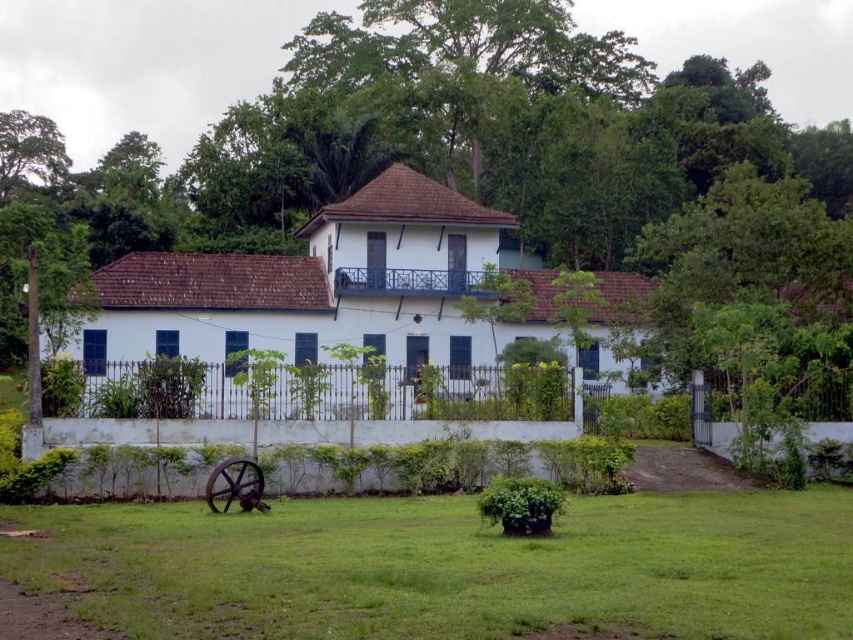
Question: Does green grass at lower center appear on the left side of green leafy tree at upper left?

Choices:
 (A) no
 (B) yes

Answer: (A)

Question: Is green grass at lower center in front of green leafy tree at upper left?

Choices:
 (A) yes
 (B) no

Answer: (A)

Question: Which object is farther from the camera taking this photo?

Choices:
 (A) green leafy tree at upper left
 (B) green grass at lower center

Answer: (A)

Question: Is green grass at lower center below green leafy tree at upper left?

Choices:
 (A) yes
 (B) no

Answer: (A)